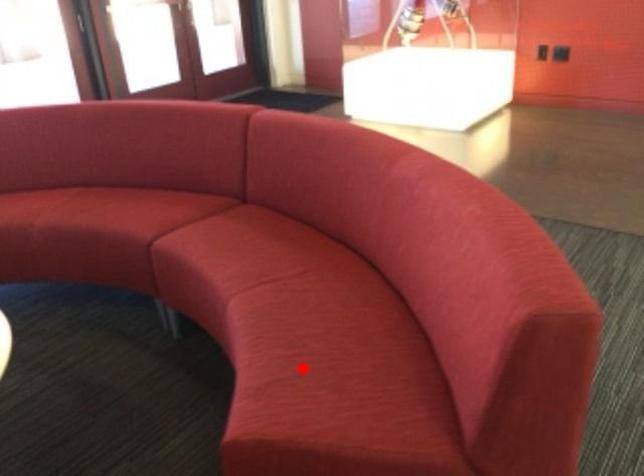
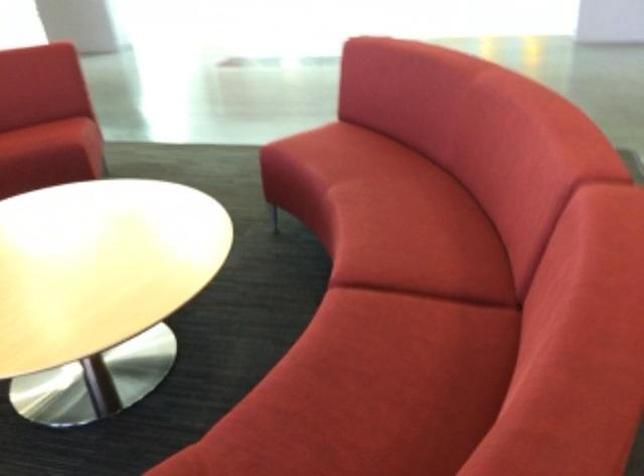
Question: A red point is marked in image1. In image2, is the corresponding 3D point closer to the camera or farther? Reply with the corresponding letter.

Choices:
 (A) The corresponding 3D point is closer.
 (B) The corresponding 3D point is farther.

Answer: (B)